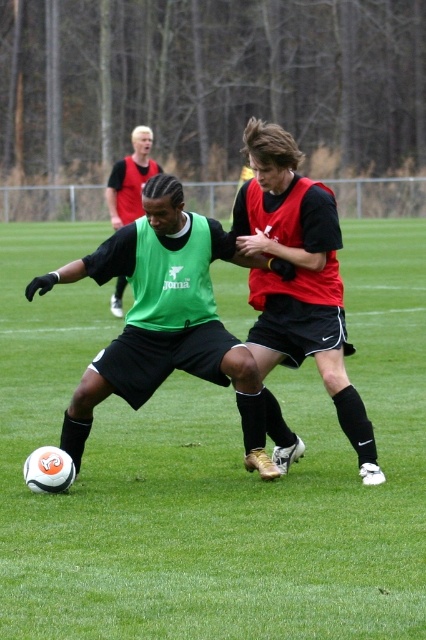
You are a referee observing the soccer match. You notice the green matte soccer ball at lower left and the red matte jersey at center. Which object appears bigger in the image?

The green matte soccer ball at lower left is larger in size than the red matte jersey at center, so it appears bigger in the image.

You are a referee observing the soccer match. You need to determine if the red matte jersey at center can reach the ball over the green matte vest at center. Based on their heights, what do you think?

The red matte jersey at center is not as tall as the green matte vest at center, so the red matte jersey at center may have difficulty reaching over the green matte vest at center due to the height difference.